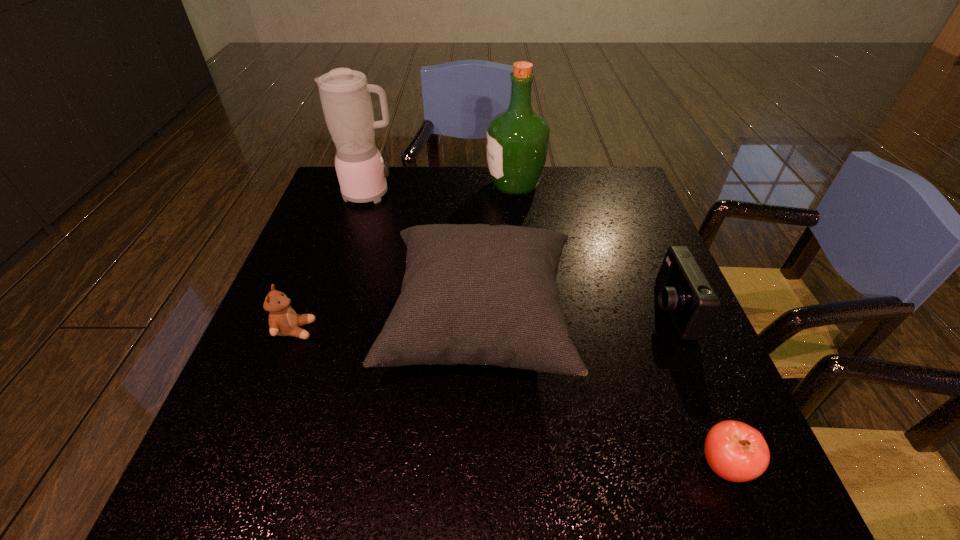
Find the location of a particular element. This screenshot has height=540, width=960. teddy bear positioned at the left edge is located at coordinates (283, 321).

This screenshot has width=960, height=540. I want to click on camera that is at the right edge, so pyautogui.click(x=684, y=291).

Find the location of a particular element. This screenshot has width=960, height=540. apple that is at the right edge is located at coordinates (735, 451).

Find the location of `object positioned at the far left corner`. object positioned at the far left corner is located at coordinates (345, 96).

Locate an element on the screen. This screenshot has height=540, width=960. object at the near right corner is located at coordinates (735, 451).

The height and width of the screenshot is (540, 960). In order to click on vacant space at the near edge in this screenshot , I will do `click(410, 494)`.

At what (x,y) coordinates should I click in order to perform the action: click on free spot at the left edge of the desktop. Please return your answer as a coordinate pair (x, y). Looking at the image, I should click on (252, 400).

In the image, there is a desktop. Find the location of `vacant space at the right edge`. vacant space at the right edge is located at coordinates (631, 343).

Where is `vacant region at the near left corner of the desktop`? Image resolution: width=960 pixels, height=540 pixels. vacant region at the near left corner of the desktop is located at coordinates (238, 474).

You are a GUI agent. You are given a task and a screenshot of the screen. Output one action in this format:
    pyautogui.click(x=<x>, y=<y>)
    Task: Click on the vacant area at the far right corner
    This screenshot has height=540, width=960.
    Given the screenshot: What is the action you would take?
    pyautogui.click(x=588, y=174)